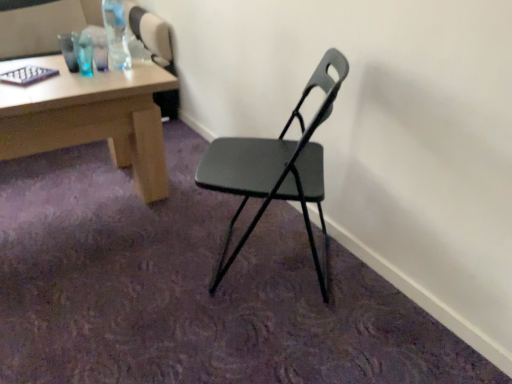
Question: In the image, is matte black chair at center on the left side or the right side of clear plastic bottle at upper left?

Choices:
 (A) right
 (B) left

Answer: (A)

Question: Would you say matte black chair at center is inside or outside clear plastic bottle at upper left?

Choices:
 (A) inside
 (B) outside

Answer: (B)

Question: Estimate the real-world distances between objects in this image. Which object is farther from the matte black chair at center?

Choices:
 (A) matte wood desk at upper left
 (B) clear plastic bottle at upper left

Answer: (B)

Question: Which object is the farthest from the clear plastic bottle at upper left?

Choices:
 (A) matte black chair at center
 (B) matte wood desk at upper left

Answer: (A)